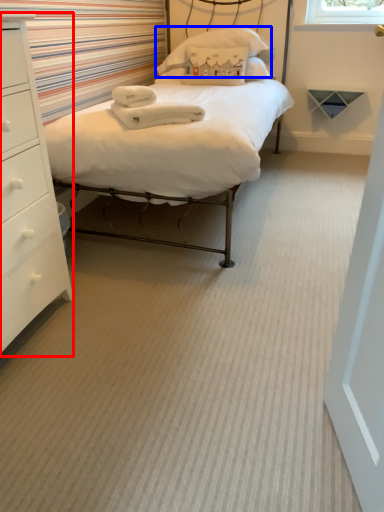
Question: Which object appears farthest to the camera in this image, chest of drawers (highlighted by a red box) or pillow (highlighted by a blue box)?

Choices:
 (A) chest of drawers
 (B) pillow

Answer: (B)